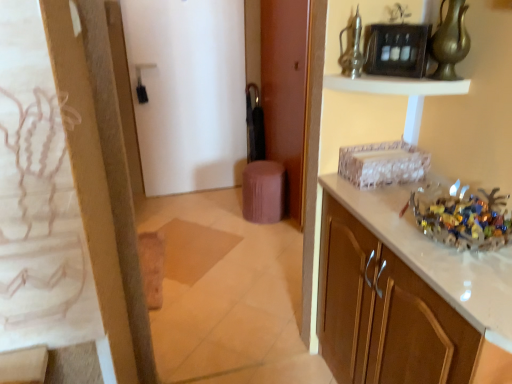
What are the coordinates of `vacant region above white glossy shelf at upper center (from a real-world perspective)` in the screenshot? It's located at (394, 77).